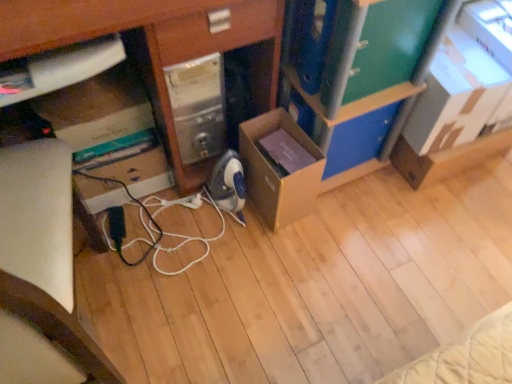
Locate an element on the screen. This screenshot has width=512, height=384. vacant space in black rubber cable at center (from a real-world perspective) is located at coordinates [x=182, y=244].